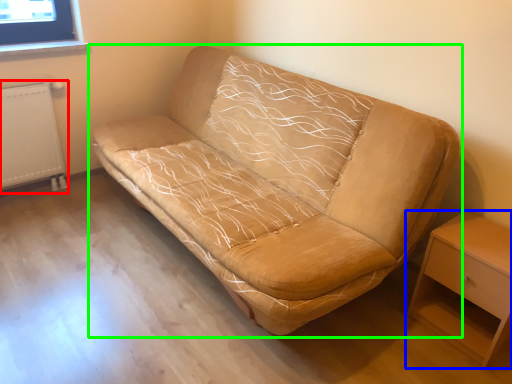
Question: Which object is positioned farthest from radiator (highlighted by a red box)? Select from nightstand (highlighted by a blue box) and studio couch (highlighted by a green box).

Choices:
 (A) nightstand
 (B) studio couch

Answer: (A)